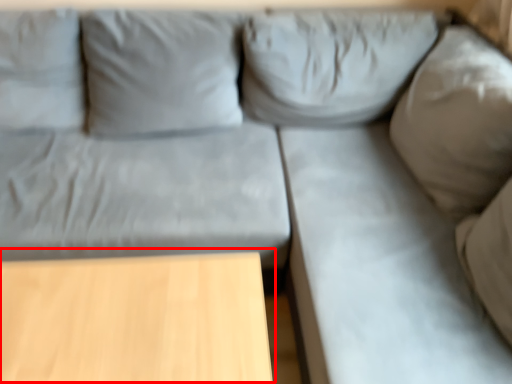
Question: From the image's perspective, considering the relative positions of table (annotated by the red box) and sheet in the image provided, where is table (annotated by the red box) located with respect to the staircase?

Choices:
 (A) below
 (B) above

Answer: (A)